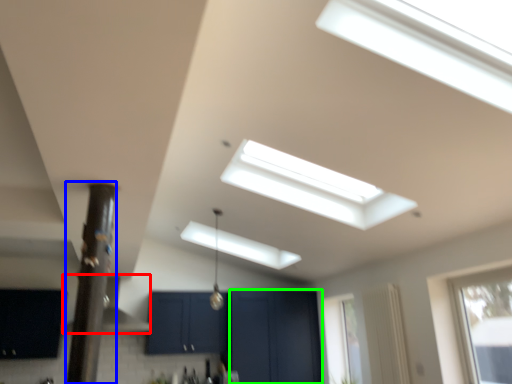
Question: Which object is the closest to the exhaust hood (highlighted by a red box)? Choose among these: pillar (highlighted by a blue box) or screen door (highlighted by a green box).

Choices:
 (A) pillar
 (B) screen door

Answer: (B)